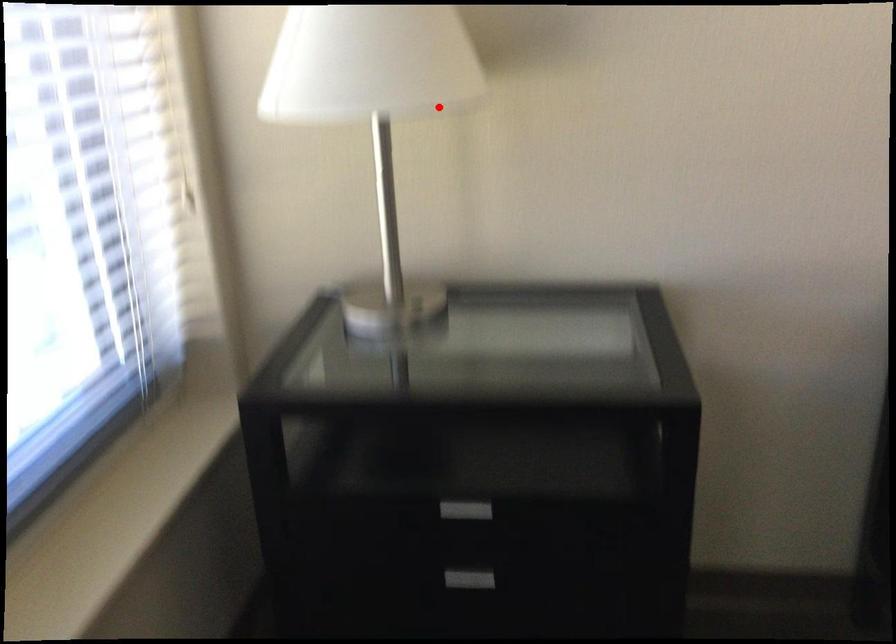
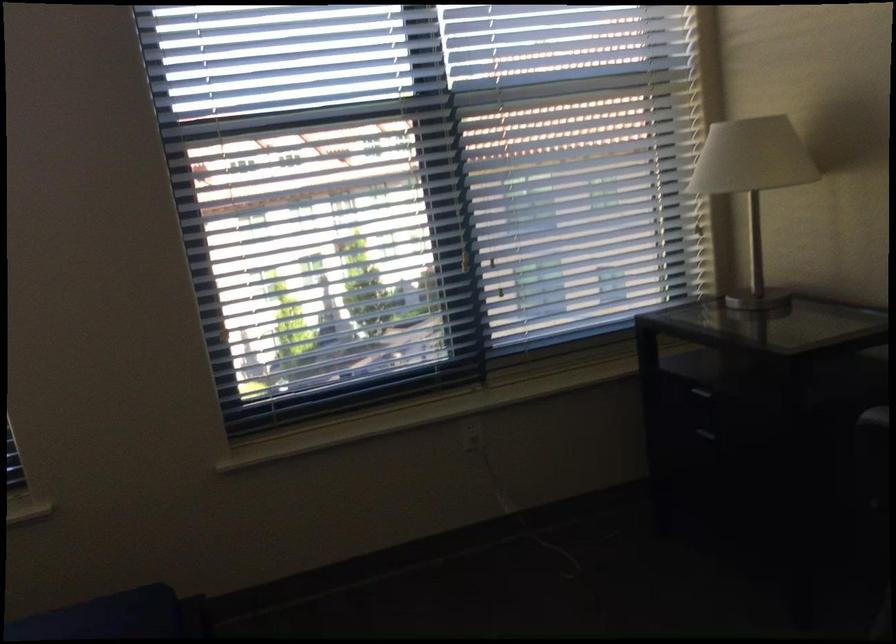
Where in the second image is the point corresponding to the highlighted location from the first image?

(753, 184)